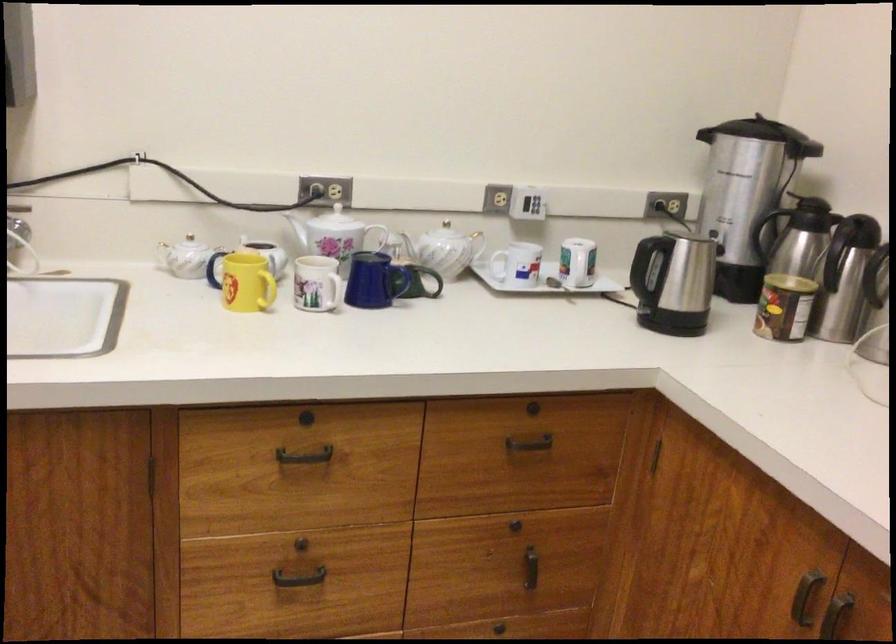
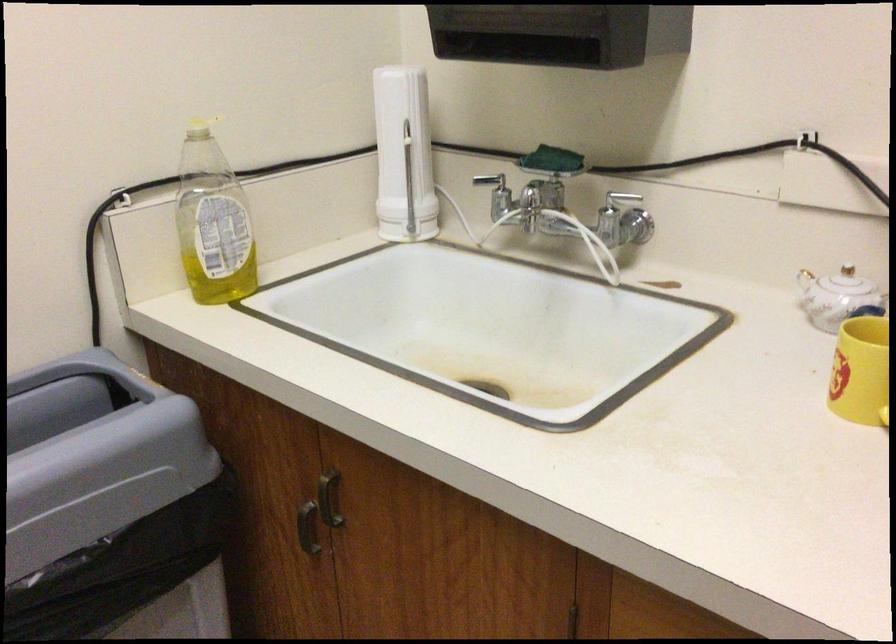
The point at (158, 471) is marked in the first image. Where is the corresponding point in the second image?

(576, 623)